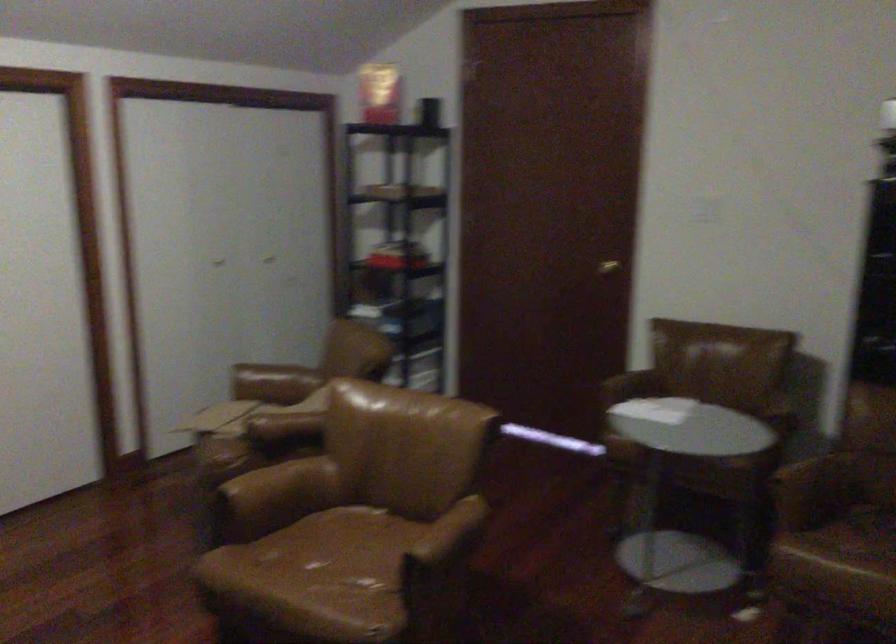
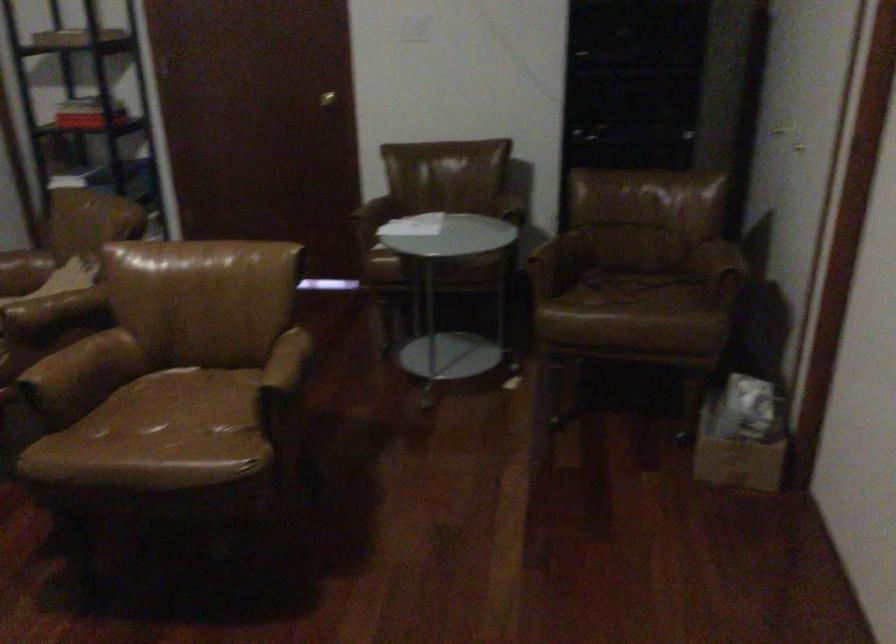
Locate, in the second image, the point that corresponds to [341,561] in the first image.

(178, 413)